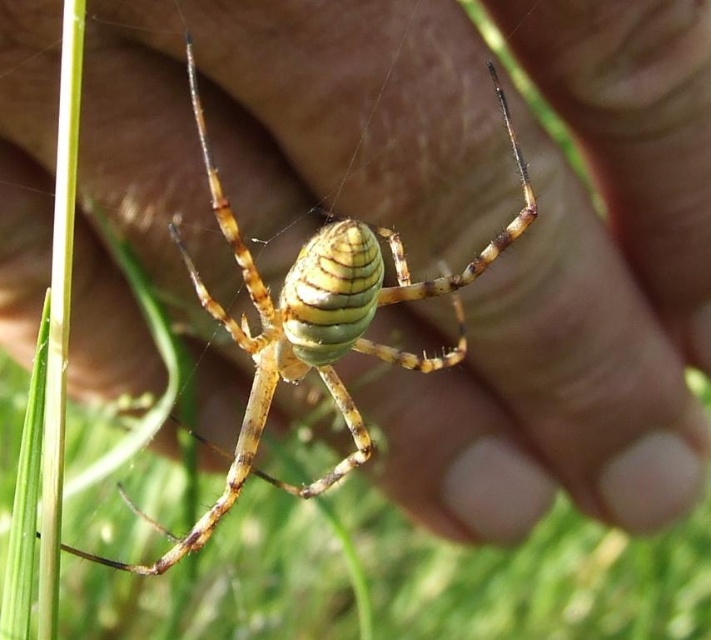
Does green grass at center have a larger size compared to yellow striped spider at center?

Yes, green grass at center is bigger than yellow striped spider at center.

Does green grass at center have a lesser width compared to yellow striped spider at center?

No.

Where is `green grass at center`? This screenshot has width=711, height=640. green grass at center is located at coordinates (400, 579).